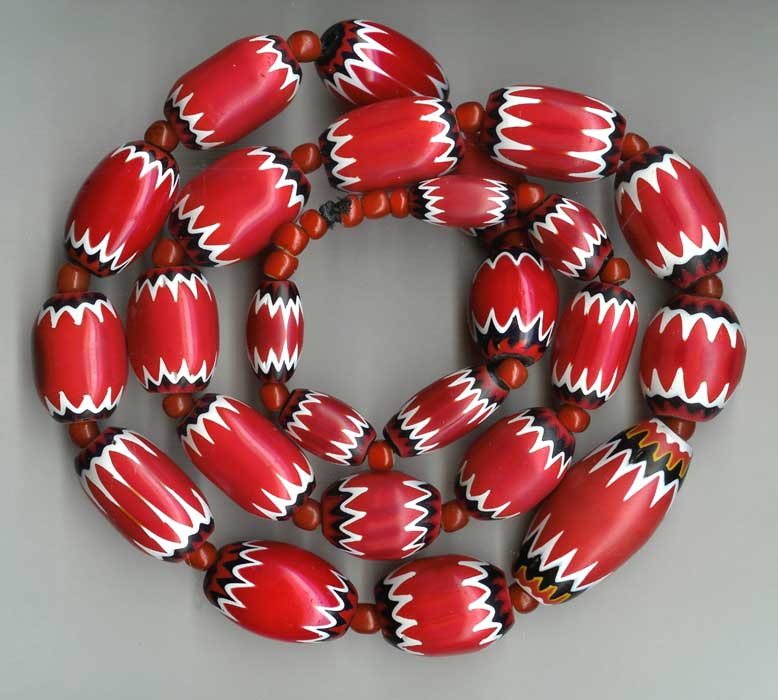
At what (x,y) coordinates should I click in order to perform the action: click on red paint. Please return your answer as a coordinate pair (x, y). Looking at the image, I should click on (436, 603), (228, 475).